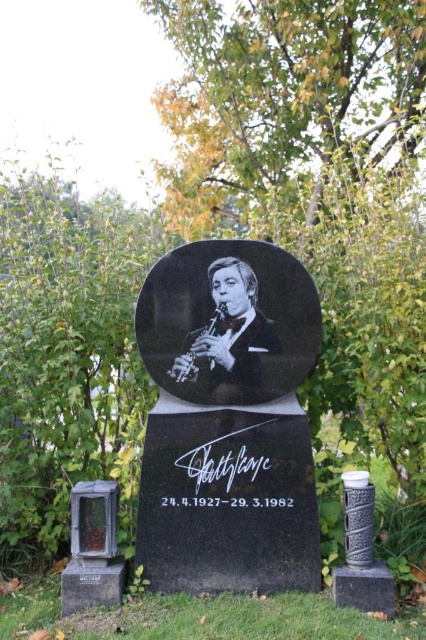
Question: Among these objects, which one is nearest to the camera?

Choices:
 (A) black glossy portrait at center
 (B) black polished stone plaque at center

Answer: (B)

Question: Considering the relative positions of black polished stone plaque at center and black glossy portrait at center in the image provided, where is black polished stone plaque at center located with respect to black glossy portrait at center?

Choices:
 (A) above
 (B) below

Answer: (B)

Question: Is black polished stone plaque at center bigger than black glossy portrait at center?

Choices:
 (A) no
 (B) yes

Answer: (B)

Question: Is black polished stone plaque at center above black glossy portrait at center?

Choices:
 (A) yes
 (B) no

Answer: (B)

Question: Which point appears farthest from the camera in this image?

Choices:
 (A) (219, 340)
 (B) (218, 337)

Answer: (B)

Question: Which point is farther to the camera?

Choices:
 (A) black polished stone plaque at center
 (B) black glossy portrait at center

Answer: (B)